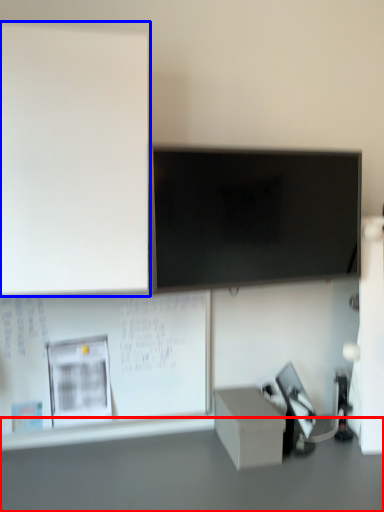
Question: Which of the following is the farthest to the observer, table (highlighted by a red box) or bulletin board (highlighted by a blue box)?

Choices:
 (A) table
 (B) bulletin board

Answer: (B)